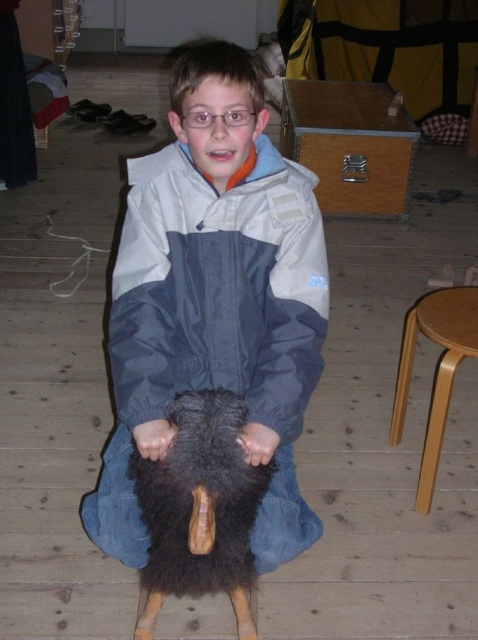
Is dark gray fabric jacket at center shorter than light brown wood stool at right?

No, dark gray fabric jacket at center is not shorter than light brown wood stool at right.

Is dark gray fabric jacket at center to the right of light brown wood stool at right from the viewer's perspective?

Incorrect, dark gray fabric jacket at center is not on the right side of light brown wood stool at right.

Between point (173, 157) and point (402, 362), which one is positioned in front?

Point (173, 157) is more forward.

Image resolution: width=478 pixels, height=640 pixels. Identify the location of dark gray fabric jacket at center. (215, 300).

Does fuzzy black animal at center have a larger size compared to light brown wood stool at right?

Yes, fuzzy black animal at center is bigger than light brown wood stool at right.

Can you confirm if fuzzy black animal at center is taller than light brown wood stool at right?

No, fuzzy black animal at center is not taller than light brown wood stool at right.

Does point (224, 438) lie in front of point (411, 328)?

Yes, it is.

You are a GUI agent. You are given a task and a screenshot of the screen. Output one action in this format:
    pyautogui.click(x=<x>, y=<y>)
    Task: Click on the fuzzy black animal at center
    This screenshot has height=640, width=478.
    Given the screenshot: What is the action you would take?
    pyautogui.click(x=199, y=508)

Can you confirm if dark gray fabric jacket at center is smaller than fuzzy black animal at center?

No, dark gray fabric jacket at center is not smaller than fuzzy black animal at center.

Is dark gray fabric jacket at center bigger than fuzzy black animal at center?

Correct, dark gray fabric jacket at center is larger in size than fuzzy black animal at center.

Where is `dark gray fabric jacket at center`? This screenshot has height=640, width=478. dark gray fabric jacket at center is located at coordinates (215, 300).